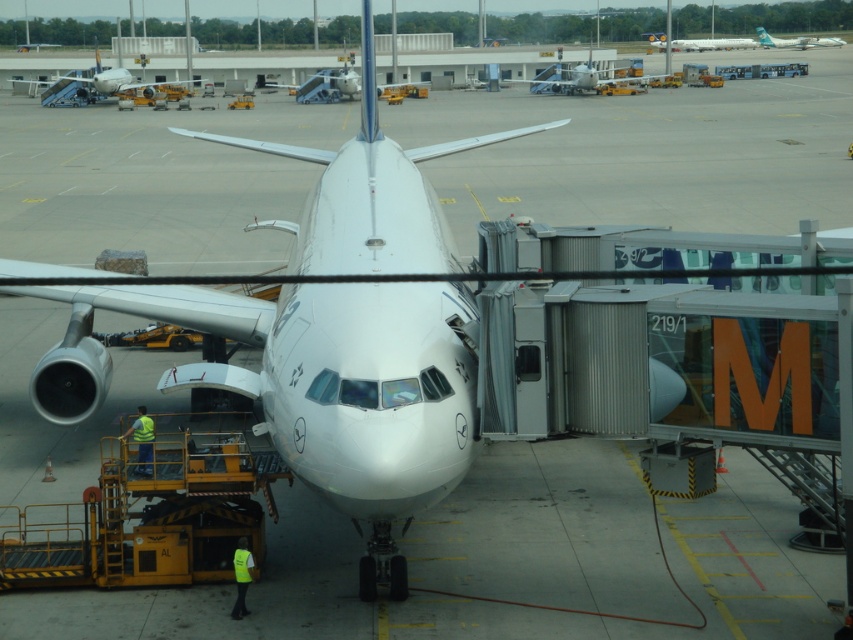
Question: Is metallic silver airplane at center to the left of metallic silver airplane at upper center from the viewer's perspective?

Choices:
 (A) yes
 (B) no

Answer: (A)

Question: Which object is positioned closest to the metallic silver airplane at center?

Choices:
 (A) silver metallic airplane at center
 (B) neon yellow safety vest at lower left
 (C) white glossy airplane at upper left
 (D) metallic silver airplane at upper center

Answer: (D)

Question: Is white glossy airplane at upper left above neon yellow safety vest at lower left?

Choices:
 (A) yes
 (B) no

Answer: (A)

Question: Which object appears closest to the camera in this image?

Choices:
 (A) metallic silver airplane at center
 (B) silver metallic airplane at center
 (C) white glossy airplane at upper left

Answer: (B)

Question: Which point is closer to the camera?

Choices:
 (A) (242, 564)
 (B) (729, 48)
 (C) (56, 88)

Answer: (A)

Question: Where is white glossy airplane at upper left located in relation to green reflective vest at lower left in the image?

Choices:
 (A) right
 (B) left

Answer: (B)